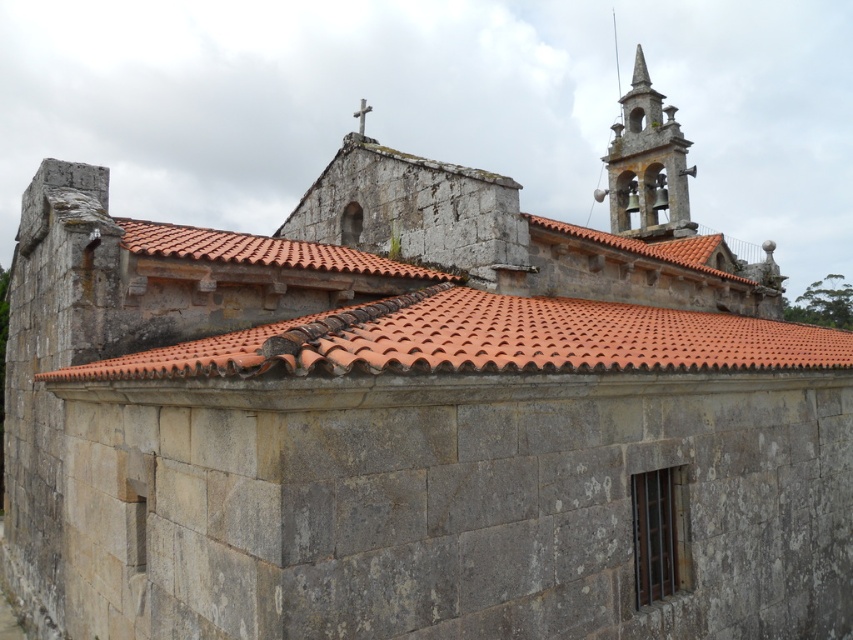
You are standing in front of the historic stone church and notice a specific point marked at coordinates point [486,340]. According to the image, where exactly is this point located?

The point [486,340] is on orange clay tiles at center.

Looking at this image, you are standing in front of the historic stone church and want to place a new decorative cross between the orange clay tiles at center and the stone bell tower at upper right. Based on their positions, where should the cross be placed?

The cross should be placed between the orange clay tiles at center and the stone bell tower at upper right, which is below the stone bell tower at upper right and above the orange clay tiles at center since the orange clay tiles at center is below the stone bell tower at upper right.

You are standing in front of the historic stone church and want to locate the orange clay tiles at center. Which direction should you look to find them?

The orange clay tiles at center are located at point coordinates of (486, 340), so you should look towards the center of the image to find them.